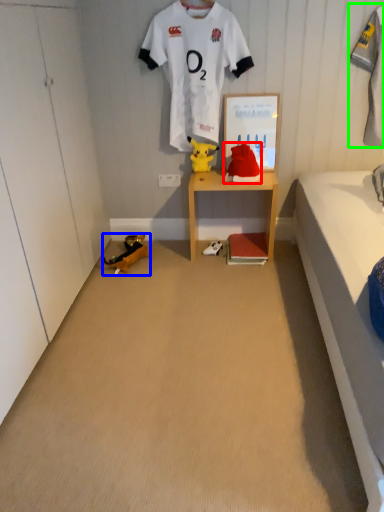
Question: Which object is the closest to the toy (highlighted by a red box)? Choose among these: toy (highlighted by a blue box) or clothing (highlighted by a green box).

Choices:
 (A) toy
 (B) clothing

Answer: (B)